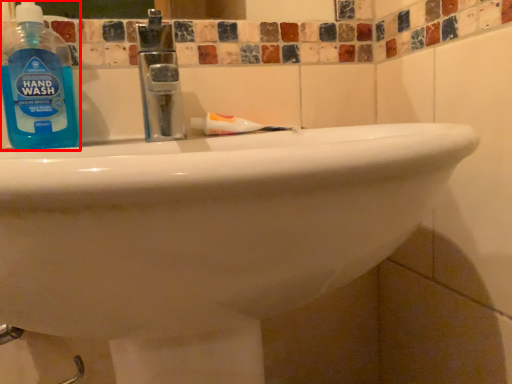
Question: From the image's perspective, considering the relative positions of cleaning product (annotated by the red box) and toothpaste in the image provided, where is cleaning product (annotated by the red box) located with respect to the staircase?

Choices:
 (A) above
 (B) below

Answer: (A)